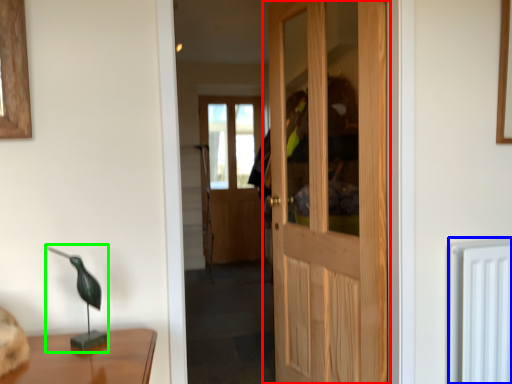
Question: Which object is the farthest from door (highlighted by a red box)? Choose among these: radiator (highlighted by a blue box) or table lamp (highlighted by a green box).

Choices:
 (A) radiator
 (B) table lamp

Answer: (B)